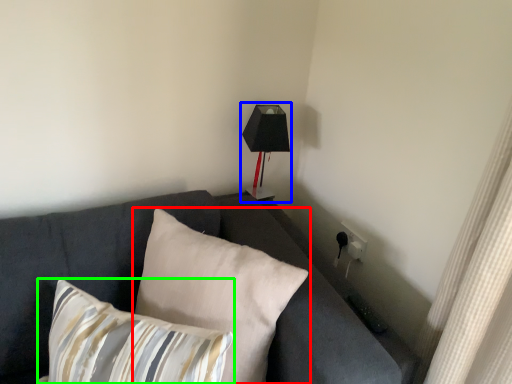
Question: Which object is positioned farthest from pillow (highlighted by a red box)? Select from table lamp (highlighted by a blue box) and pillow (highlighted by a green box).

Choices:
 (A) table lamp
 (B) pillow

Answer: (A)